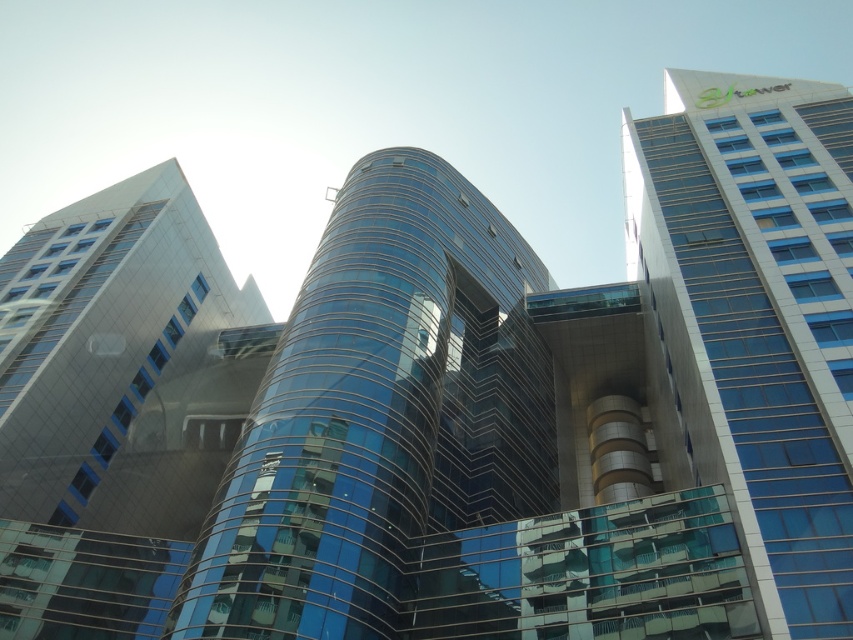
Question: Which of the following is the farthest from the observer?

Choices:
 (A) (509, 324)
 (B) (819, 288)

Answer: (A)

Question: Which point appears closest to the camera in this image?

Choices:
 (A) (248, 396)
 (B) (723, 385)
 (C) (422, 198)

Answer: (B)

Question: Is blue glass building at upper right thinner than transparent glass building at center?

Choices:
 (A) yes
 (B) no

Answer: (A)

Question: Based on their relative distances, which object is farther from the transparent glass building at center?

Choices:
 (A) blue glass building at upper right
 (B) shiny glass tower at center

Answer: (A)

Question: Does blue glass building at upper right have a larger size compared to transparent glass building at center?

Choices:
 (A) no
 (B) yes

Answer: (A)

Question: Where is shiny glass tower at center located in relation to blue glass building at upper right in the image?

Choices:
 (A) below
 (B) above

Answer: (A)